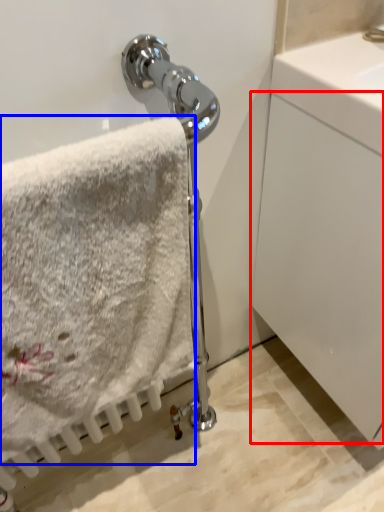
Question: Which of the following is the farthest to the observer, glass door (highlighted by a red box) or towel (highlighted by a blue box)?

Choices:
 (A) glass door
 (B) towel

Answer: (A)